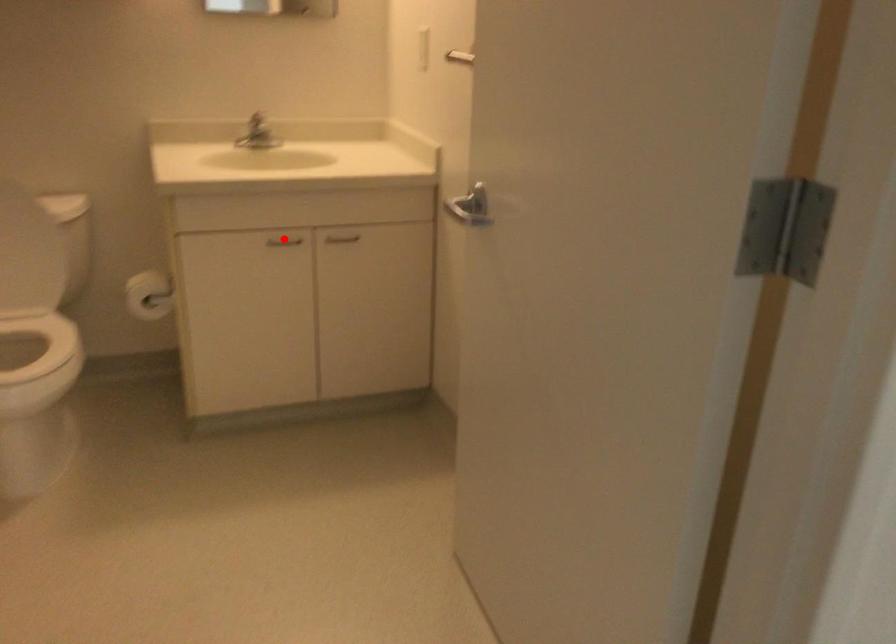
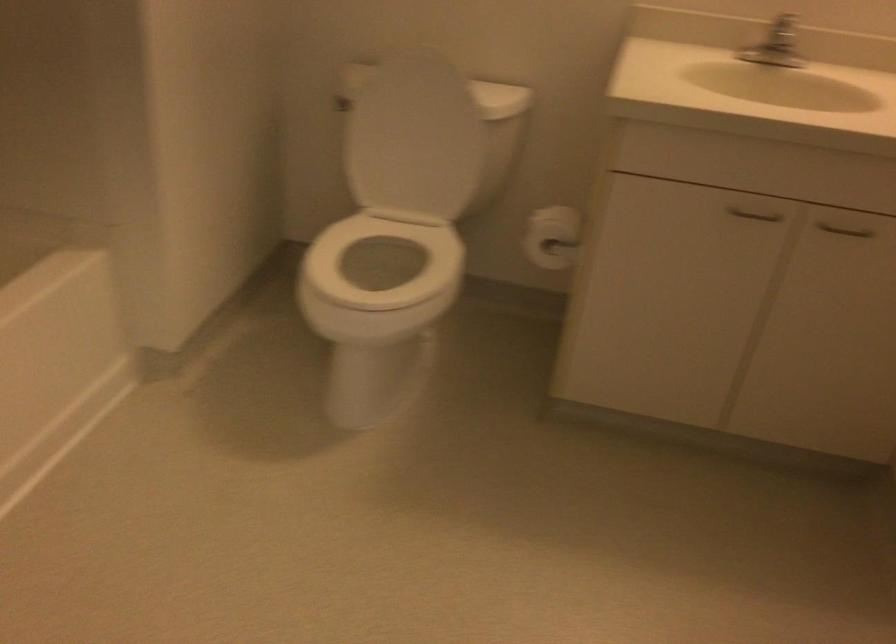
The point at the highlighted location is marked in the first image. Where is the corresponding point in the second image?

(754, 214)